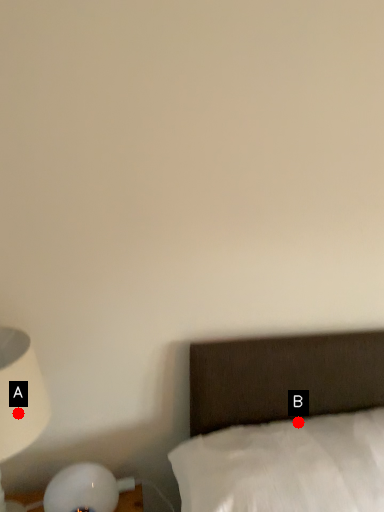
Question: Two points are circled on the image, labeled by A and B beside each circle. Which of the following is the farthest from the observer?

Choices:
 (A) A is further
 (B) B is further

Answer: (B)